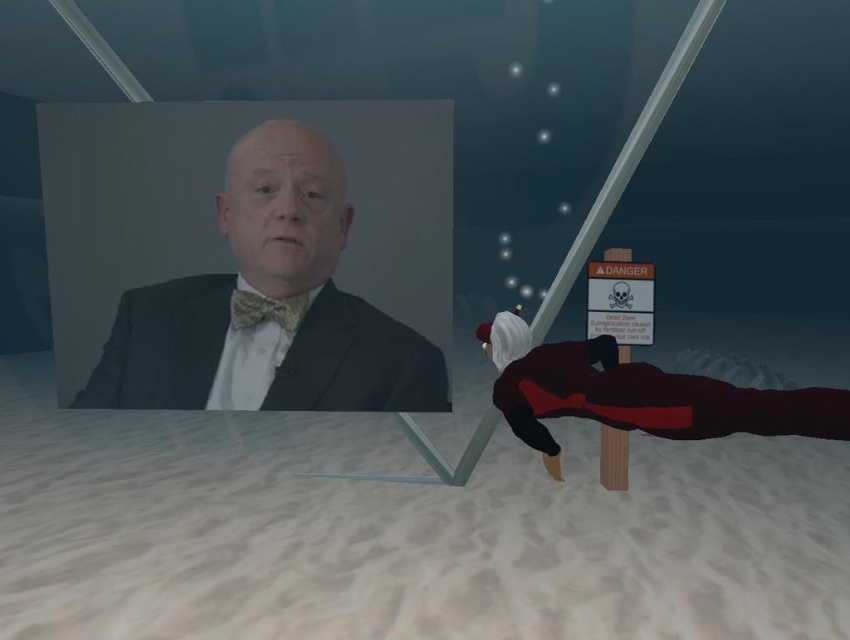
Question: Observing the image, what is the correct spatial positioning of white sandy beach at lower center in reference to matte black suit at upper left?

Choices:
 (A) below
 (B) above

Answer: (A)

Question: Can you confirm if white sandy beach at lower center is positioned to the right of matte black suit at upper left?

Choices:
 (A) no
 (B) yes

Answer: (A)

Question: In this image, where is white sandy beach at lower center located relative to gold textured bow tie at center?

Choices:
 (A) left
 (B) right

Answer: (A)

Question: Estimate the real-world distances between objects in this image. Which object is closer to the matte black suit at left?

Choices:
 (A) white sandy beach at lower center
 (B) matte black suit at upper left
 (C) gold textured bow tie at center

Answer: (B)

Question: Which is farther from the gold textured bow tie at center?

Choices:
 (A) white sandy beach at lower center
 (B) matte black suit at upper left

Answer: (A)

Question: Which point is farther to the camera?

Choices:
 (A) (299, 292)
 (B) (272, 216)
 (C) (412, 378)

Answer: (C)